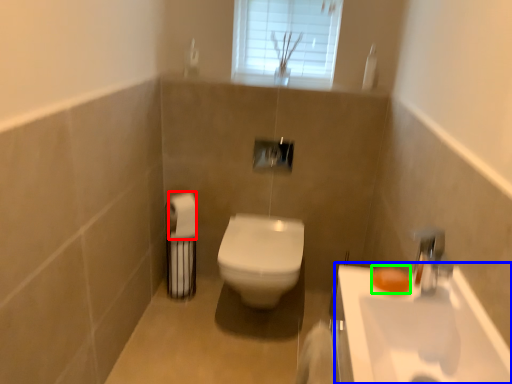
Question: Based on their relative distances, which object is nearer to toilet paper (highlighted by a red box)? Choose from sink (highlighted by a blue box) and soap (highlighted by a green box).

Choices:
 (A) sink
 (B) soap

Answer: (B)